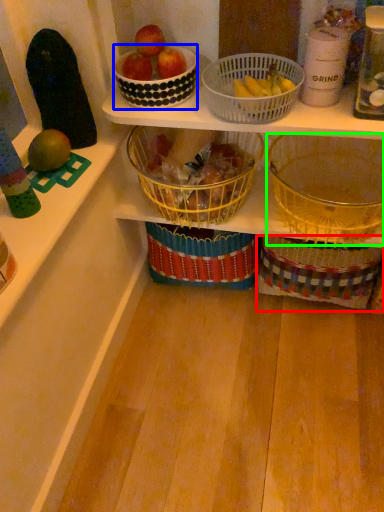
Question: Which is farther away from gift basket (highlighted by a red box)? bowl (highlighted by a blue box) or basket (highlighted by a green box)?

Choices:
 (A) bowl
 (B) basket

Answer: (A)